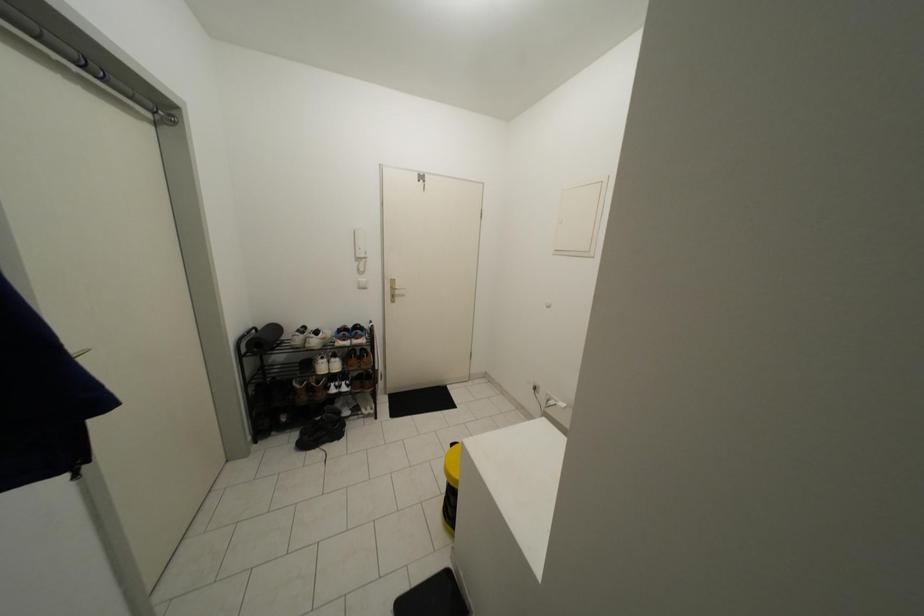
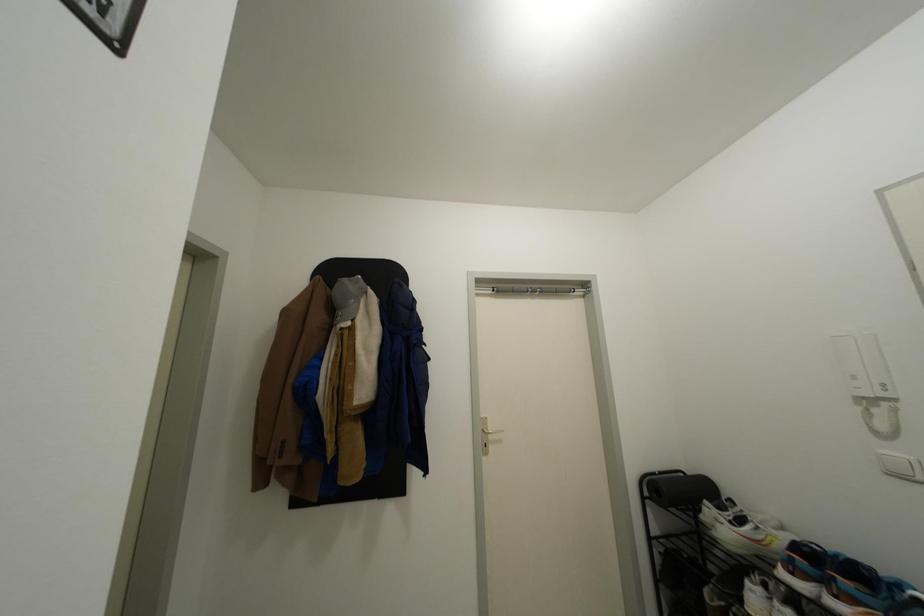
Question: The camera is either moving clockwise (left) or counter-clockwise (right) around the object. The first image is from the beginning of the video and the second image is from the end. Is the camera moving left or right when shooting the video?

Choices:
 (A) Left
 (B) Right

Answer: (B)